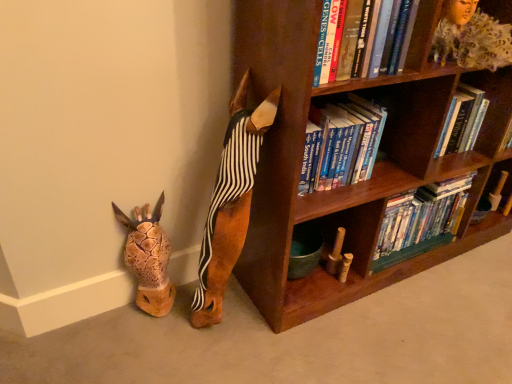
Question: From a real-world perspective, is wooden bookshelf at upper right positioned above or below hardcover books at center, the 1th book from the back?

Choices:
 (A) below
 (B) above

Answer: (B)

Question: Considering the relative positions of wooden bookshelf at upper right and hardcover books at center, which ranks as the 2th book in top-to-bottom order, in the image provided, is wooden bookshelf at upper right to the left or to the right of hardcover books at center, which ranks as the 2th book in top-to-bottom order,?

Choices:
 (A) right
 (B) left

Answer: (A)

Question: Considering the real-world distances, which object is farthest from the brown wooden bookcase at upper right?

Choices:
 (A) wooden giraffe head at lower left, arranged as the first animal when viewed from the left
 (B) hardcover book at upper center, the 2th book in the back-to-front sequence
 (C) brown wooden dog at center, which appears as the 2th animal when viewed from the left
 (D) hardcover books at center, which ranks as the 2th book in top-to-bottom order
 (E) hardcover books at upper right

Answer: (A)

Question: Which is farther from the brown wooden dog at center, placed as the first animal when sorted from right to left?

Choices:
 (A) wooden bookshelf at upper right
 (B) brown wooden bookcase at upper right
 (C) hardcover book at upper center, which is the 2th book from bottom to top
 (D) hardcover books at center, the 1th book from the back
 (E) hardcover books at upper right

Answer: (E)